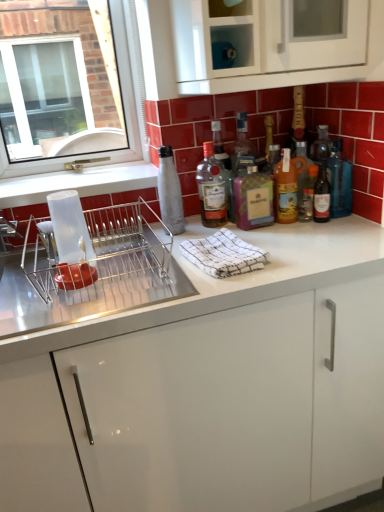
The image size is (384, 512). I want to click on free point in front of matte glass wine bottle at center-right, so click(x=332, y=240).